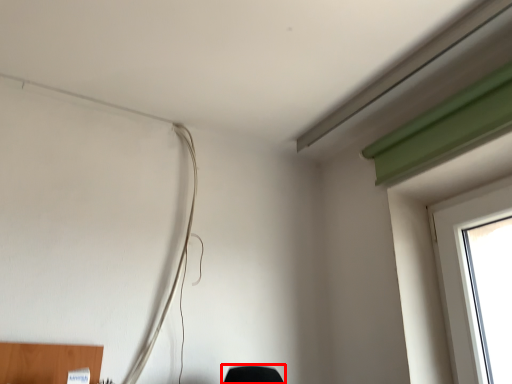
Question: From the image's perspective, where is furniture (annotated by the red box) located in relation to wire in the image?

Choices:
 (A) below
 (B) above

Answer: (A)